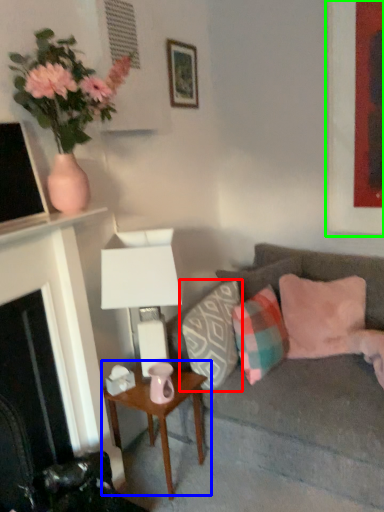
Question: Estimate the real-world distances between objects in this image. Which object is farther from pillow (highlighted by a red box), table (highlighted by a blue box) or picture frame (highlighted by a green box)?

Choices:
 (A) table
 (B) picture frame

Answer: (B)